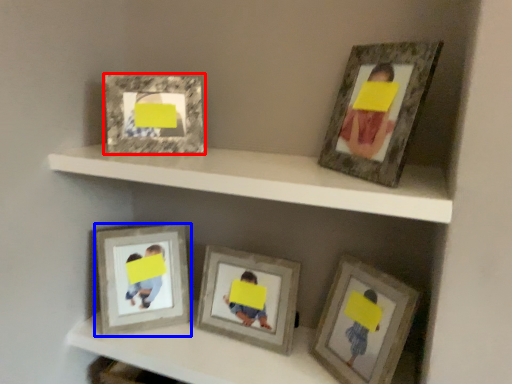
Question: Among these objects, which one is farthest to the camera, picture frame (highlighted by a red box) or picture frame (highlighted by a blue box)?

Choices:
 (A) picture frame
 (B) picture frame

Answer: (B)